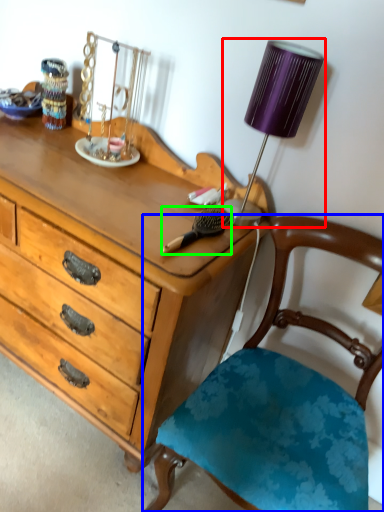
Question: Which is farther away from lamp (highlighted by a red box)? chair (highlighted by a blue box) or brush (highlighted by a green box)?

Choices:
 (A) chair
 (B) brush

Answer: (A)